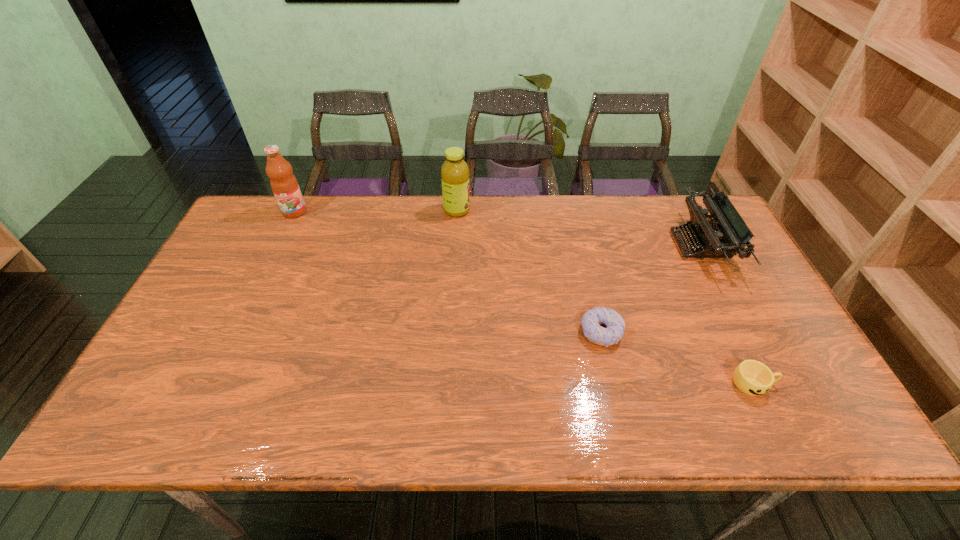
This screenshot has height=540, width=960. I want to click on blank space that satisfies the following two spatial constraints: 1. on the front label of the cup; 2. on the left side of the right fruit juice, so (x=446, y=384).

Identify the location of free space that satisfies the following two spatial constraints: 1. on the typing side of the typewriter; 2. on the front side of the nearest object. (773, 384).